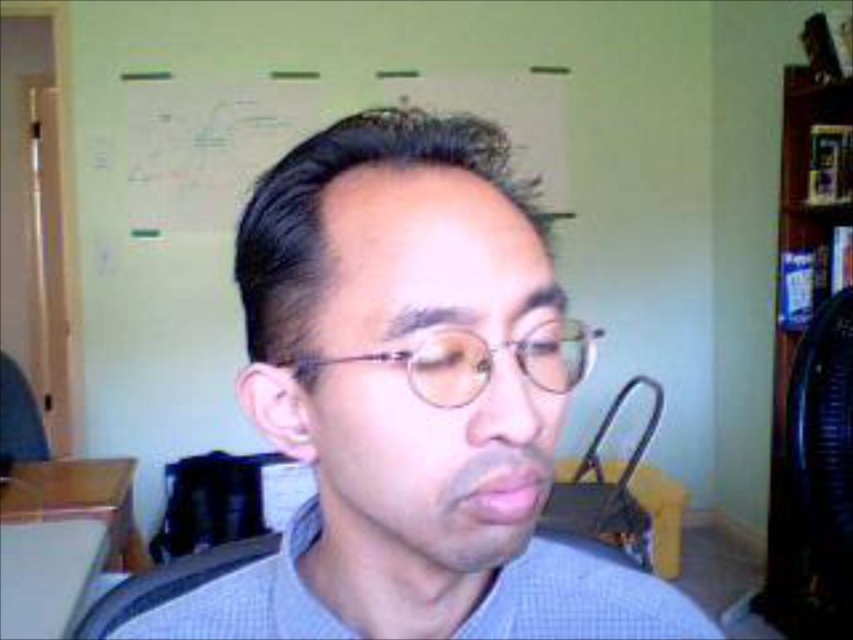
Question: Which object is closer to the camera taking this photo?

Choices:
 (A) blue checkered shirt at center
 (B) matte gray shirt at center

Answer: (B)

Question: Is blue checkered shirt at center smaller than clear plastic glasses at center?

Choices:
 (A) yes
 (B) no

Answer: (B)

Question: Which object appears farthest from the camera in this image?

Choices:
 (A) matte gray shirt at center
 (B) matte glass glasses at center

Answer: (B)

Question: Which point is closer to the camera?

Choices:
 (A) matte gray shirt at center
 (B) matte glass glasses at center

Answer: (A)

Question: Does matte glass glasses at center have a larger size compared to blue checkered shirt at center?

Choices:
 (A) yes
 (B) no

Answer: (B)

Question: Can you confirm if matte gray shirt at center is positioned above blue checkered shirt at center?

Choices:
 (A) no
 (B) yes

Answer: (B)